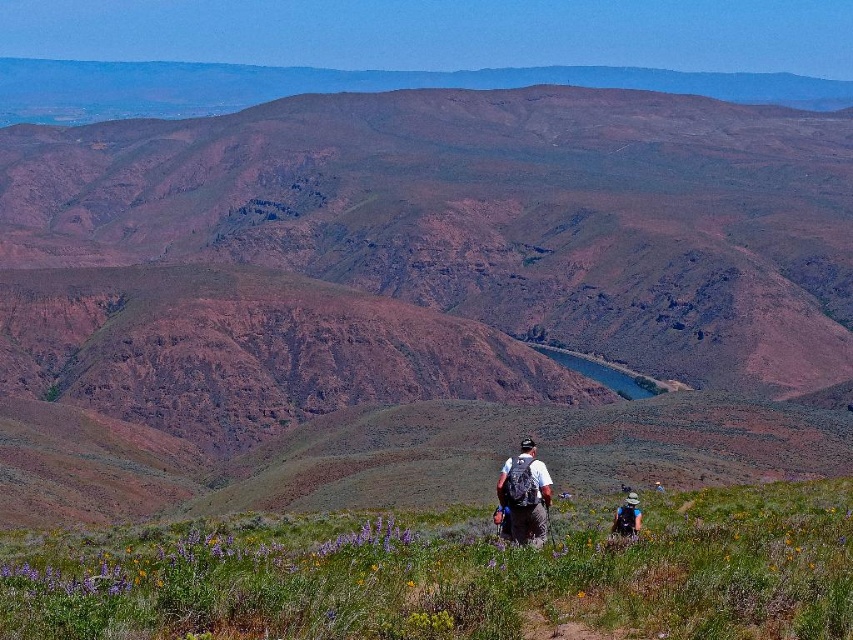
Does point (529, 493) come farther from viewer compared to point (624, 509)?

No.

Does matte black backpack at center have a lesser width compared to matte gray backpack at lower center?

No.

Locate an element on the screen. matte black backpack at center is located at coordinates (525, 493).

Image resolution: width=853 pixels, height=640 pixels. I want to click on matte black backpack at center, so coord(525,493).

Is brown rocky mountain at center to the left of matte gray backpack at lower center from the viewer's perspective?

Indeed, brown rocky mountain at center is positioned on the left side of matte gray backpack at lower center.

Who is positioned more to the left, brown rocky mountain at center or matte gray backpack at lower center?

From the viewer's perspective, brown rocky mountain at center appears more on the left side.

Describe the element at coordinates (399, 268) in the screenshot. I see `brown rocky mountain at center` at that location.

At what (x,y) coordinates should I click in order to perform the action: click on brown rocky mountain at center. Please return your answer as a coordinate pair (x, y). Image resolution: width=853 pixels, height=640 pixels. Looking at the image, I should click on (399, 268).

Looking at this image, does brown rocky mountain at center have a lesser height compared to matte black backpack at center?

No, brown rocky mountain at center is not shorter than matte black backpack at center.

Who is more distant from viewer, [543,168] or [543,470]?

Positioned behind is point [543,168].

Describe the element at coordinates (399, 268) in the screenshot. I see `brown rocky mountain at center` at that location.

Locate an element on the screen. Image resolution: width=853 pixels, height=640 pixels. brown rocky mountain at center is located at coordinates (399, 268).